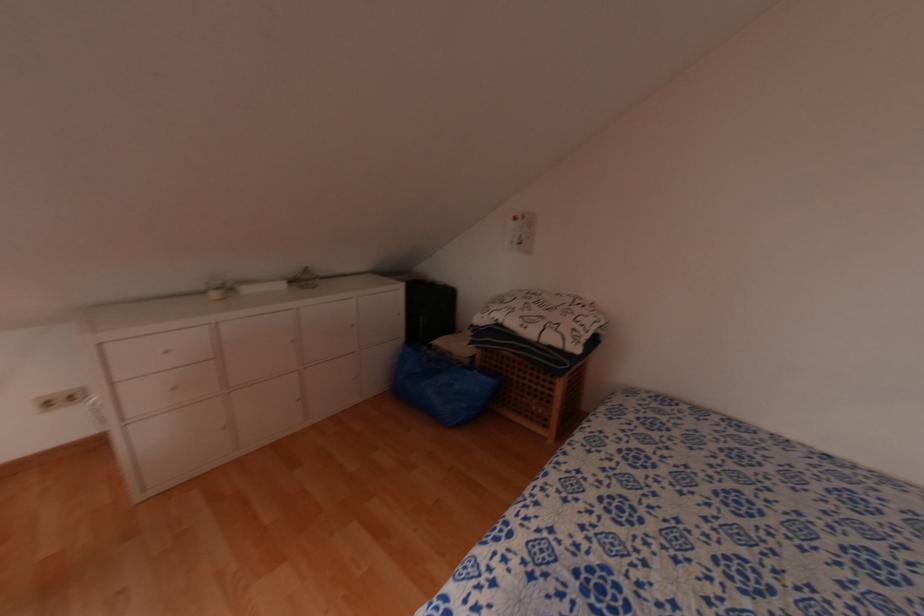
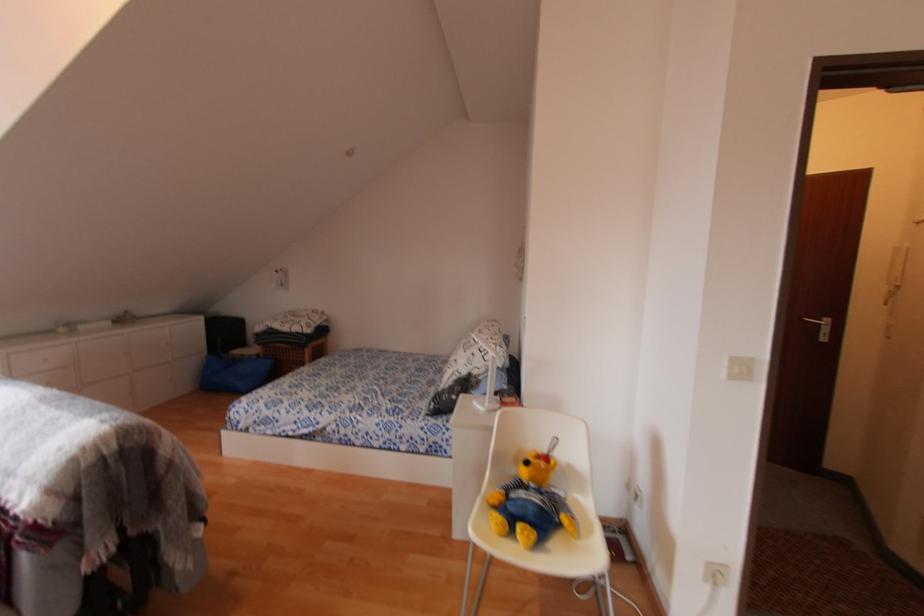
Where in the second image is the point corresponding to pixel 467 362 from the first image?

(253, 358)